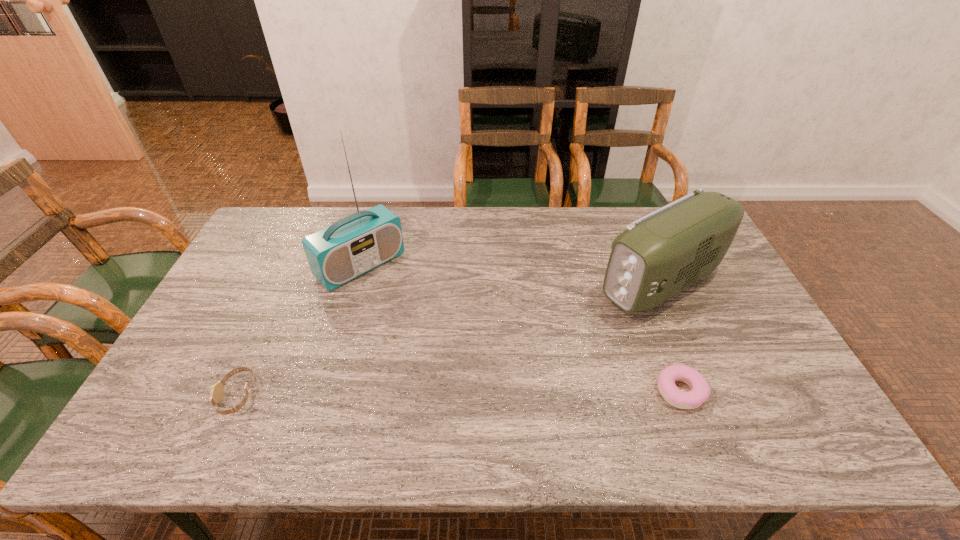
Identify the location of empty space between the third object from right to left and the right radio receiver. This screenshot has height=540, width=960. (511, 274).

Locate an element on the screen. Image resolution: width=960 pixels, height=540 pixels. empty space that is in between the right radio receiver and the pastry is located at coordinates (671, 337).

This screenshot has width=960, height=540. Find the location of `free space that is in between the shortest object and the shorter radio receiver`. free space that is in between the shortest object and the shorter radio receiver is located at coordinates (671, 337).

Find the location of `free area in between the leftmost object and the shortest object`. free area in between the leftmost object and the shortest object is located at coordinates (459, 393).

This screenshot has height=540, width=960. In order to click on vacant area between the right radio receiver and the left radio receiver in this screenshot , I will do `click(511, 274)`.

Find the location of a particular element. The image size is (960, 540). vacant area that lies between the right radio receiver and the shortest object is located at coordinates (671, 337).

Identify the location of vacant region between the taller radio receiver and the watch. The height and width of the screenshot is (540, 960). (300, 330).

At what (x,y) coordinates should I click in order to perform the action: click on free spot between the tallest object and the leftmost object. Please return your answer as a coordinate pair (x, y). The width and height of the screenshot is (960, 540). Looking at the image, I should click on (300, 330).

Identify the location of object that is the third closest one to the right radio receiver. The image size is (960, 540). point(217,390).

Find the location of a particular element. The width and height of the screenshot is (960, 540). object that is the closest to the leftmost object is located at coordinates (358, 243).